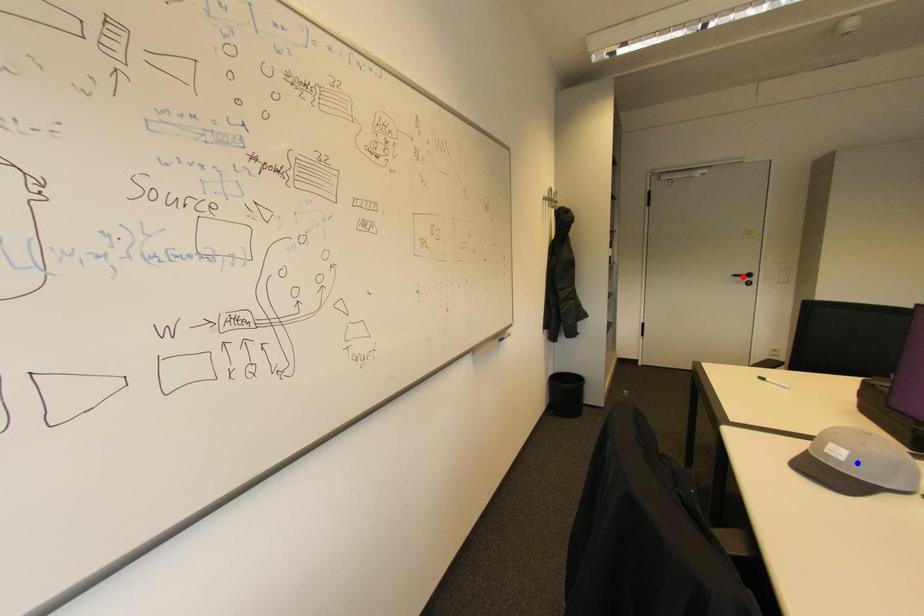
Question: In the image, two points are highlighted. Which point is nearer to the camera? Reply with the corresponding letter.

Choices:
 (A) blue point
 (B) red point

Answer: (A)